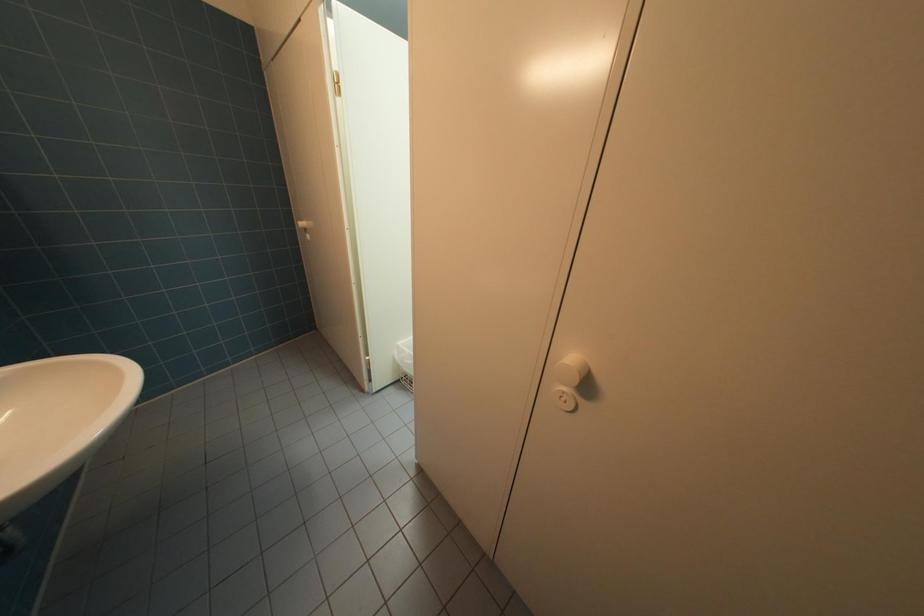
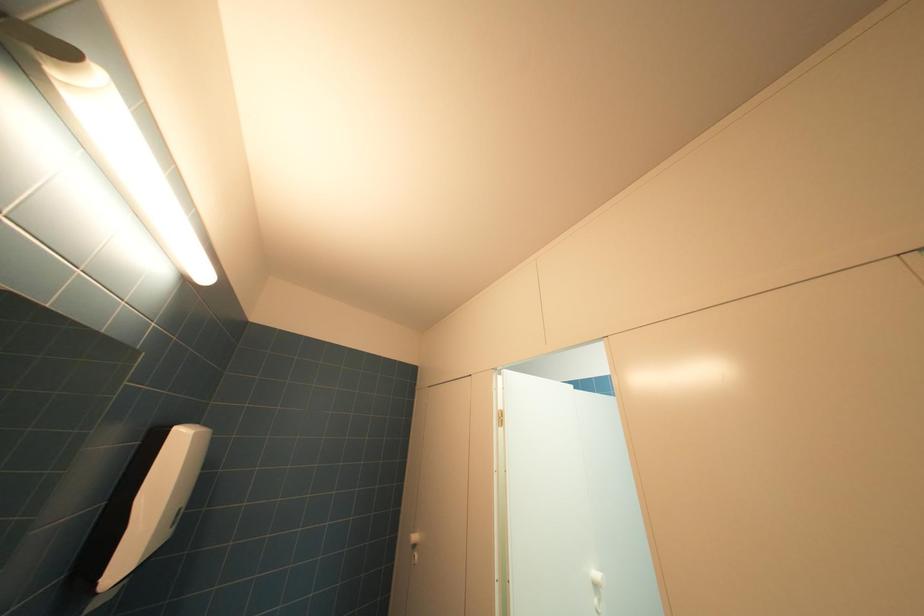
Based on the continuous images, in which direction is the camera rotating?

The camera's rotation is toward left-up.